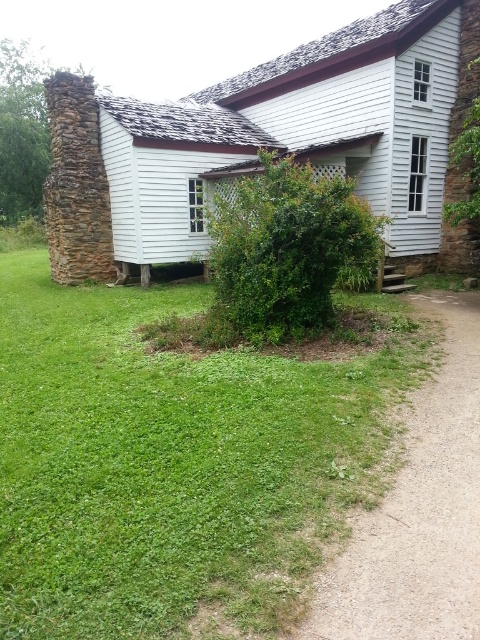
Question: Can you confirm if white wooden cottage at left is bigger than dirt/gravel path at lower right?

Choices:
 (A) yes
 (B) no

Answer: (A)

Question: Which of the following is the farthest from the observer?

Choices:
 (A) white wooden cottage at left
 (B) green grass at lower left

Answer: (A)

Question: Based on their relative distances, which object is farther from the dirt/gravel path at lower right?

Choices:
 (A) green grass at lower left
 (B) white wooden cottage at left

Answer: (B)

Question: Can you confirm if green grass at lower left is positioned to the right of dirt/gravel path at lower right?

Choices:
 (A) yes
 (B) no

Answer: (B)

Question: Which point is closer to the camera?

Choices:
 (A) white wooden cottage at left
 (B) dirt/gravel path at lower right
 (C) green grass at lower left

Answer: (C)

Question: Where is green grass at lower left located in relation to white wooden cottage at left in the image?

Choices:
 (A) left
 (B) right

Answer: (A)